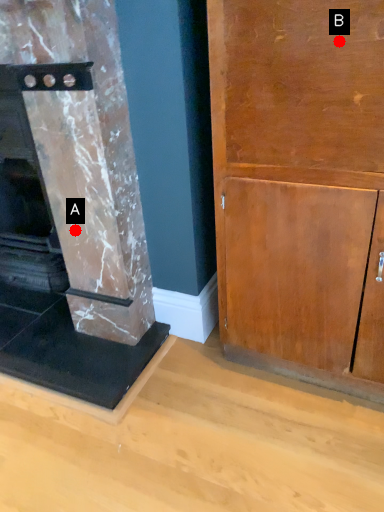
Question: Two points are circled on the image, labeled by A and B beside each circle. Which point is further to the camera?

Choices:
 (A) A is further
 (B) B is further

Answer: (A)